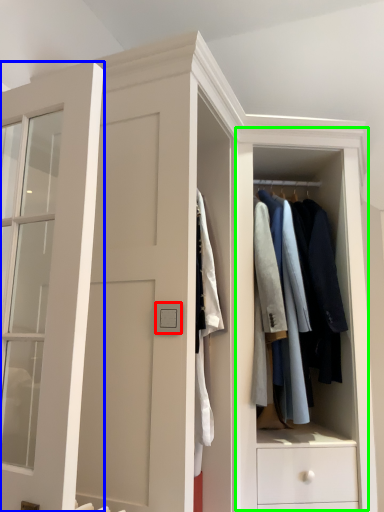
Question: Based on their relative distances, which object is nearer to light switch (highlighted by a red box)? Choose from door (highlighted by a blue box) and dresser (highlighted by a green box).

Choices:
 (A) door
 (B) dresser

Answer: (A)